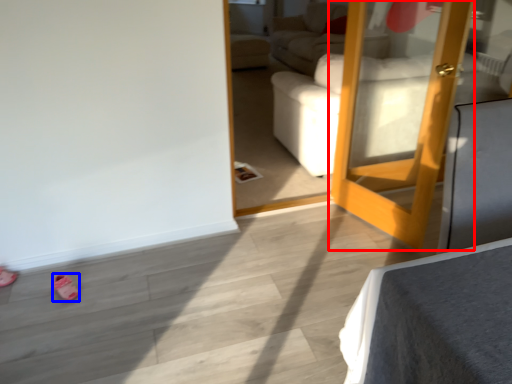
Question: Which of the following is the farthest to the observer, door (highlighted by a red box) or shoe (highlighted by a blue box)?

Choices:
 (A) door
 (B) shoe

Answer: (B)